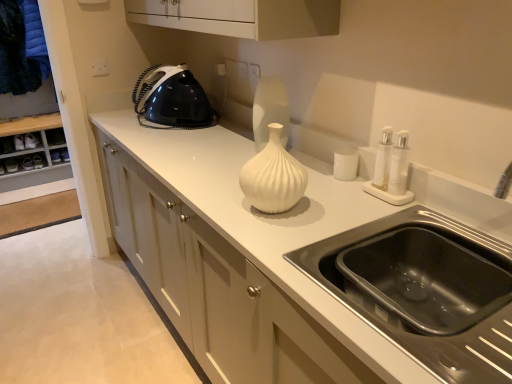
Question: Considering the relative sizes of black stainless steel sink at lower right and white matte cup at center in the image provided, is black stainless steel sink at lower right bigger than white matte cup at center?

Choices:
 (A) no
 (B) yes

Answer: (B)

Question: Is black stainless steel sink at lower right smaller than white matte cup at center?

Choices:
 (A) yes
 (B) no

Answer: (B)

Question: Can you confirm if black stainless steel sink at lower right is positioned to the left of white matte cup at center?

Choices:
 (A) yes
 (B) no

Answer: (B)

Question: From a real-world perspective, does black stainless steel sink at lower right stand above white matte cup at center?

Choices:
 (A) no
 (B) yes

Answer: (A)

Question: From the image's perspective, is black stainless steel sink at lower right located beneath white matte cup at center?

Choices:
 (A) yes
 (B) no

Answer: (A)

Question: Does black stainless steel sink at lower right have a greater height compared to white matte cup at center?

Choices:
 (A) yes
 (B) no

Answer: (A)

Question: From a real-world perspective, is white glossy cabinet at center physically below black plastic iron at upper left?

Choices:
 (A) yes
 (B) no

Answer: (A)

Question: Is black plastic iron at upper left at the back of white glossy cabinet at center?

Choices:
 (A) yes
 (B) no

Answer: (B)

Question: From the image's perspective, is white glossy cabinet at center below black plastic iron at upper left?

Choices:
 (A) no
 (B) yes

Answer: (B)

Question: Is white glossy cabinet at center to the right of black plastic iron at upper left from the viewer's perspective?

Choices:
 (A) no
 (B) yes

Answer: (B)

Question: From a real-world perspective, is white glossy cabinet at center physically above black plastic iron at upper left?

Choices:
 (A) yes
 (B) no

Answer: (B)

Question: Does white glossy cabinet at center turn towards black plastic iron at upper left?

Choices:
 (A) no
 (B) yes

Answer: (A)

Question: Can you see white glossy cabinet at center touching dark blue fabric at left?

Choices:
 (A) yes
 (B) no

Answer: (B)